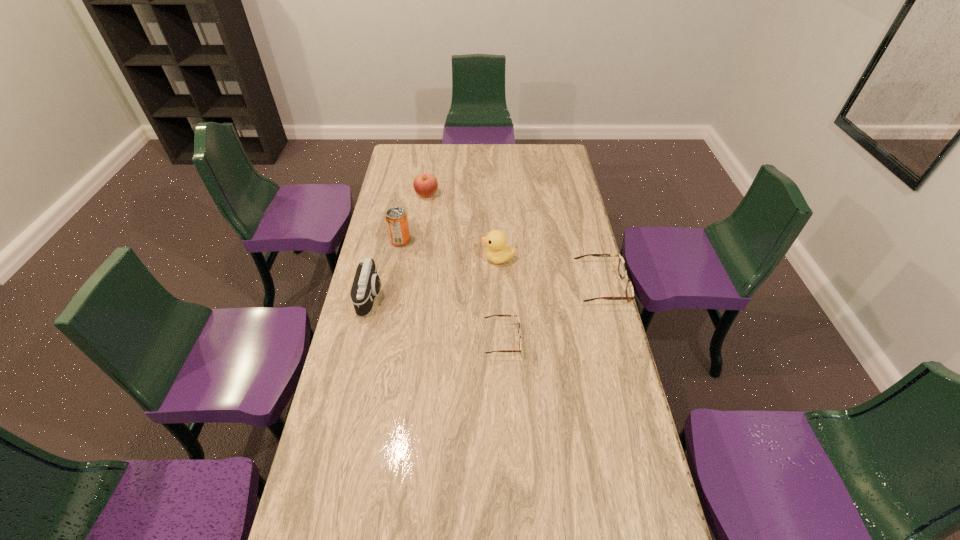
Locate an element on the screen. This screenshot has width=960, height=540. empty location between the nearer spectacles and the apple is located at coordinates (465, 267).

This screenshot has width=960, height=540. Identify the location of empty location between the duck and the soda can. (449, 249).

What are the coordinates of `free space between the camera and the duck` in the screenshot? It's located at (435, 277).

I want to click on free space between the rightmost object and the duck, so pyautogui.click(x=549, y=273).

Identify the location of free space between the right spectacles and the farthest object. The image size is (960, 540). (514, 240).

Locate an element on the screen. The height and width of the screenshot is (540, 960). object that stands as the second closest to the right spectacles is located at coordinates (518, 322).

Identify which object is the fourth nearest to the farthest object. Please provide its 2D coordinates. Your answer should be formatted as a tuple, i.e. [(x, y)], where the tuple contains the x and y coordinates of a point satisfying the conditions above.

[(622, 270)]